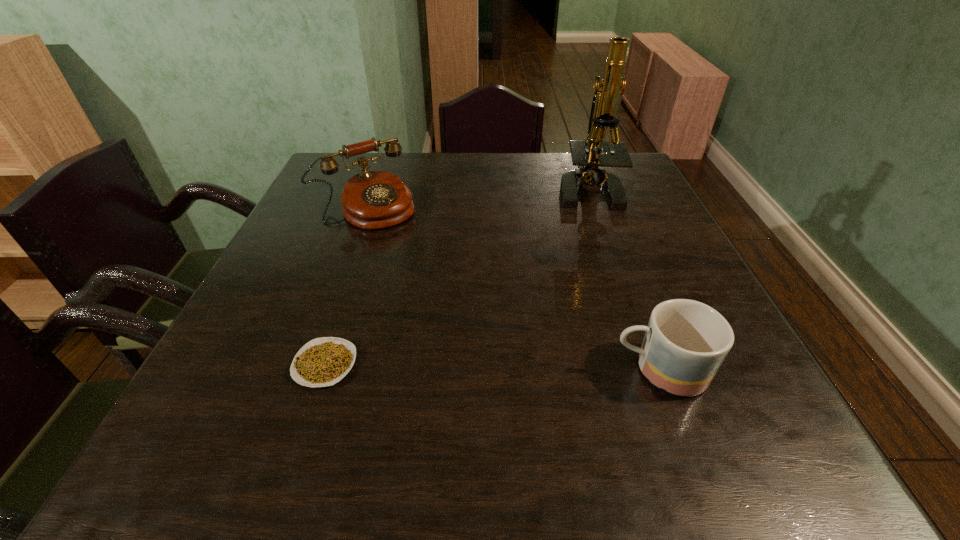
I want to click on free space at the near left corner of the desktop, so click(210, 400).

In the image, there is a desktop. At what (x,y) coordinates should I click in order to perform the action: click on vacant area at the far right corner. Please return your answer as a coordinate pair (x, y). This screenshot has height=540, width=960. Looking at the image, I should click on (623, 168).

You are a GUI agent. You are given a task and a screenshot of the screen. Output one action in this format:
    pyautogui.click(x=<x>, y=<y>)
    Task: Click on the vacant space at the near right corner of the desktop
    The width and height of the screenshot is (960, 540).
    Given the screenshot: What is the action you would take?
    pyautogui.click(x=730, y=388)

At what (x,y) coordinates should I click in order to perform the action: click on free spot between the third tallest object and the tallest object. Please return your answer as a coordinate pair (x, y). The height and width of the screenshot is (540, 960). Looking at the image, I should click on (623, 279).

You are a GUI agent. You are given a task and a screenshot of the screen. Output one action in this format:
    pyautogui.click(x=<x>, y=<y>)
    Task: Click on the free space that is in between the microscope and the third tallest object
    This screenshot has height=540, width=960.
    Given the screenshot: What is the action you would take?
    (623, 279)

Find the location of `empty location between the tallest object and the telephone`. empty location between the tallest object and the telephone is located at coordinates (477, 198).

Identify the location of free space that is in between the tallest object and the mug. The image size is (960, 540). (623, 279).

Find the location of a particular element. The height and width of the screenshot is (540, 960). vacant space that is in between the second shortest object and the tallest object is located at coordinates (623, 279).

Where is `vacant point located between the tallest object and the third shortest object`? Image resolution: width=960 pixels, height=540 pixels. vacant point located between the tallest object and the third shortest object is located at coordinates [477, 198].

The height and width of the screenshot is (540, 960). Identify the location of free spot between the telephone and the microscope. (477, 198).